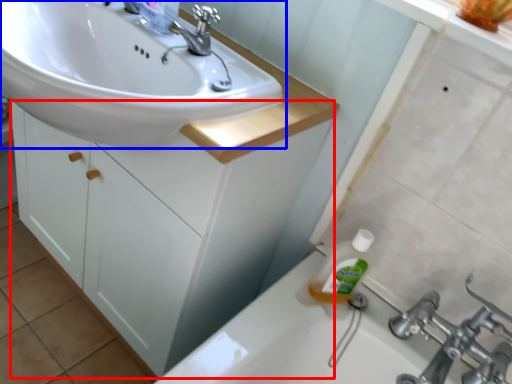
Question: Which object is further to the camera taking this photo, bathroom cabinet (highlighted by a red box) or sink (highlighted by a blue box)?

Choices:
 (A) bathroom cabinet
 (B) sink

Answer: (A)